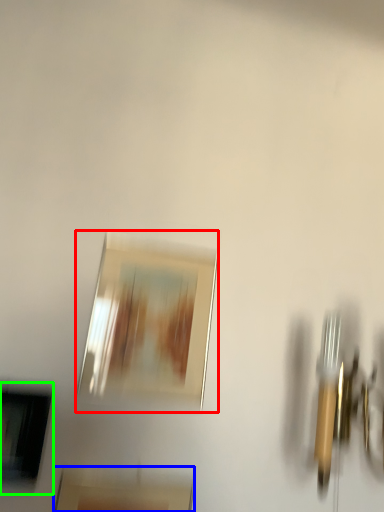
Question: Based on their relative distances, which object is farther from picture frame (highlighted by a red box)? Choose from picture frame (highlighted by a blue box) and picture frame (highlighted by a green box).

Choices:
 (A) picture frame
 (B) picture frame

Answer: (A)